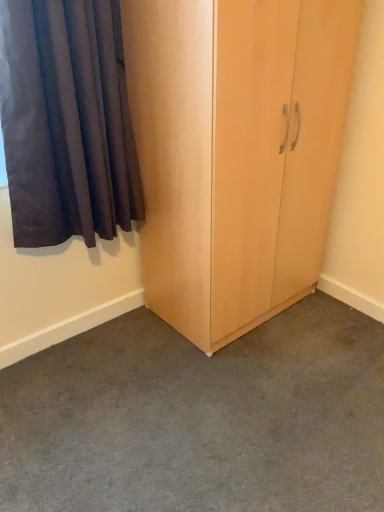
Question: Is light wood cupboard at center placed right next to dark blue fabric curtain at left?

Choices:
 (A) no
 (B) yes

Answer: (A)

Question: Could you tell me if light wood cupboard at center is turned towards dark blue fabric curtain at left?

Choices:
 (A) no
 (B) yes

Answer: (A)

Question: Considering the relative sizes of light wood cupboard at center and dark blue fabric curtain at left in the image provided, is light wood cupboard at center bigger than dark blue fabric curtain at left?

Choices:
 (A) no
 (B) yes

Answer: (B)

Question: Is light wood cupboard at center taller than dark blue fabric curtain at left?

Choices:
 (A) no
 (B) yes

Answer: (B)

Question: Is light wood cupboard at center oriented away from dark blue fabric curtain at left?

Choices:
 (A) no
 (B) yes

Answer: (A)

Question: In terms of size, does light wood cupboard at center appear bigger or smaller than dark blue fabric curtain at left?

Choices:
 (A) big
 (B) small

Answer: (A)

Question: Looking at their shapes, would you say light wood cupboard at center is wider or thinner than dark blue fabric curtain at left?

Choices:
 (A) wide
 (B) thin

Answer: (A)

Question: Is light wood cupboard at center situated inside dark blue fabric curtain at left or outside?

Choices:
 (A) inside
 (B) outside

Answer: (B)

Question: From their relative heights in the image, would you say light wood cupboard at center is taller or shorter than dark blue fabric curtain at left?

Choices:
 (A) tall
 (B) short

Answer: (A)

Question: Is light wood cupboard at center spatially inside carpeted floor at center, or outside of it?

Choices:
 (A) outside
 (B) inside

Answer: (A)

Question: In terms of height, does light wood cupboard at center look taller or shorter compared to carpeted floor at center?

Choices:
 (A) short
 (B) tall

Answer: (B)

Question: Looking at their shapes, would you say light wood cupboard at center is wider or thinner than carpeted floor at center?

Choices:
 (A) thin
 (B) wide

Answer: (A)

Question: From the image's perspective, is light wood cupboard at center above or below carpeted floor at center?

Choices:
 (A) below
 (B) above

Answer: (B)

Question: From a real-world perspective, is dark blue fabric curtain at left positioned above or below carpeted floor at center?

Choices:
 (A) above
 (B) below

Answer: (A)

Question: Is dark blue fabric curtain at left to the left or to the right of carpeted floor at center in the image?

Choices:
 (A) right
 (B) left

Answer: (B)